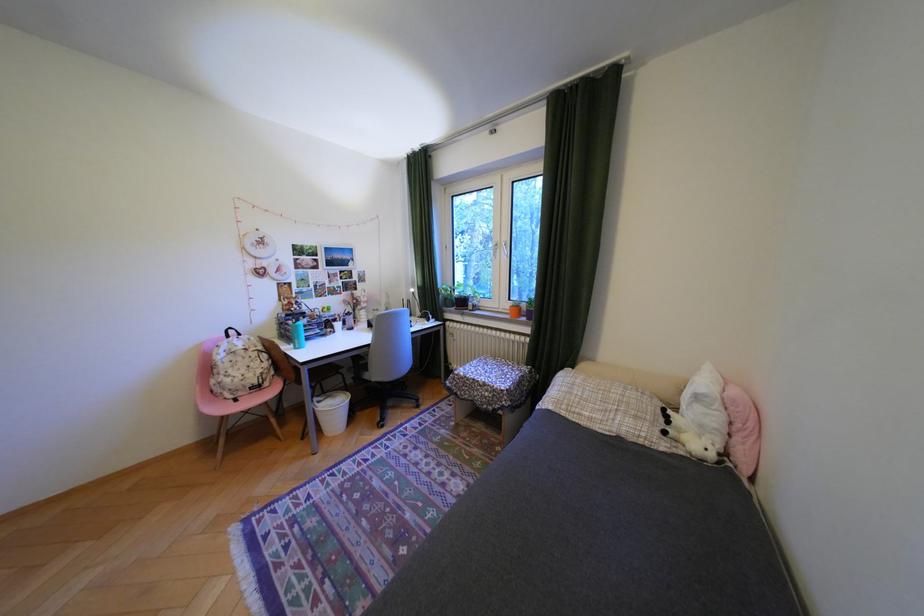
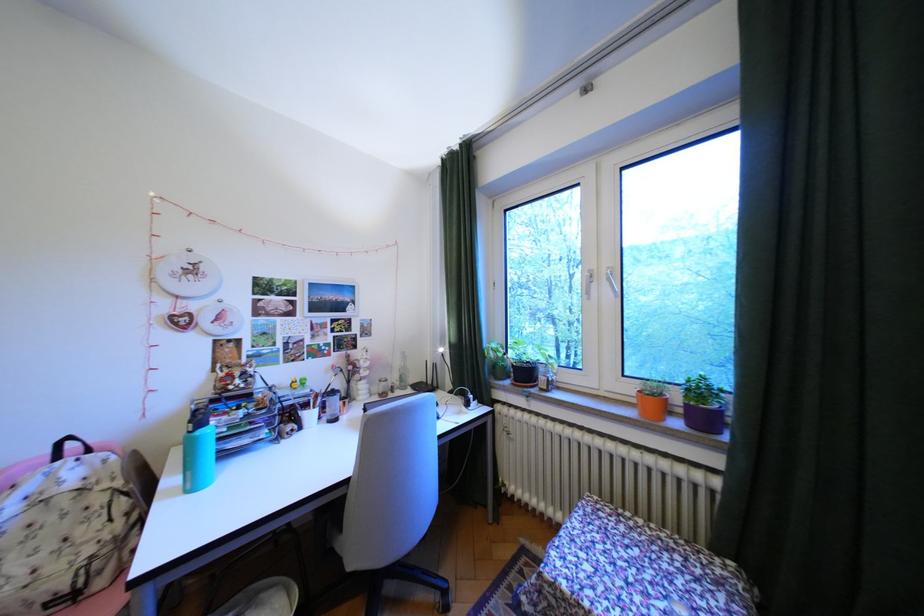
Where in the second image is the point corresponding to [381,346] from the first image?

(359, 483)